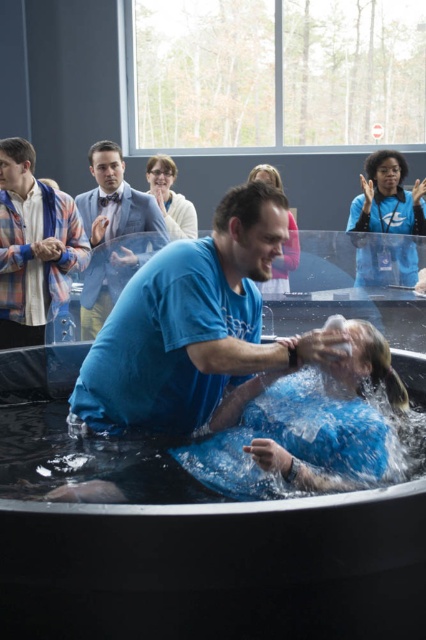
What do you see at coordinates (186, 540) in the screenshot?
I see `black rubber tub at center` at bounding box center [186, 540].

Which is above, black rubber tub at center or blue fabric suit at center?

blue fabric suit at center is above.

I want to click on black rubber tub at center, so click(186, 540).

How much distance is there between plaid shirt at left and blue fabric shirt at upper center?

plaid shirt at left is 3.18 meters from blue fabric shirt at upper center.

Who is higher up, plaid shirt at left or blue fabric shirt at upper center?

blue fabric shirt at upper center is above.

Which is in front, point (77, 234) or point (362, 272)?

Point (77, 234)

Find the location of `plaid shirt at left`. plaid shirt at left is located at coordinates (34, 246).

Is black rubber tub at center positioned in front of matte white sweater at upper center?

That is False.

Is point (278, 536) closer to camera compared to point (147, 161)?

Yes, it is in front of point (147, 161).

At what (x,y) coordinates should I click in order to perform the action: click on black rubber tub at center. Please return your answer as a coordinate pair (x, y). The width and height of the screenshot is (426, 640). Looking at the image, I should click on (186, 540).

The image size is (426, 640). Identify the location of black rubber tub at center. (186, 540).